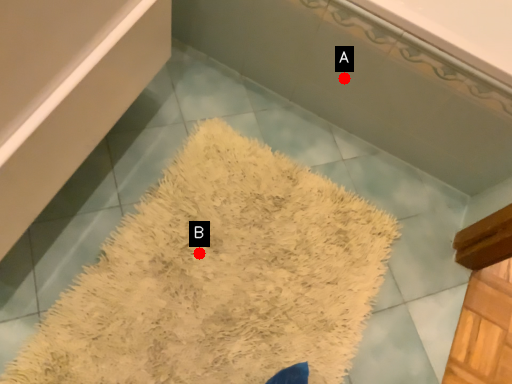
Question: Two points are circled on the image, labeled by A and B beside each circle. Among these points, which one is farthest from the camera?

Choices:
 (A) A is further
 (B) B is further

Answer: (A)